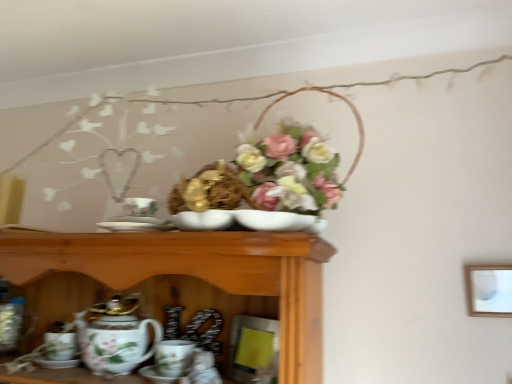
Question: Can you confirm if porcelain coffee cup at lower center is positioned to the left of matte white picture frame at upper right?

Choices:
 (A) yes
 (B) no

Answer: (A)

Question: Are porcelain coffee cup at lower center and matte white picture frame at upper right far apart?

Choices:
 (A) no
 (B) yes

Answer: (A)

Question: Does porcelain coffee cup at lower center have a lesser height compared to matte white picture frame at upper right?

Choices:
 (A) no
 (B) yes

Answer: (B)

Question: From the image's perspective, is porcelain coffee cup at lower center located beneath matte white picture frame at upper right?

Choices:
 (A) no
 (B) yes

Answer: (B)

Question: Is porcelain coffee cup at lower center positioned before matte white picture frame at upper right?

Choices:
 (A) yes
 (B) no

Answer: (A)

Question: From a real-world perspective, is porcelain coffee cup at lower center above or below matte white picture frame at upper right?

Choices:
 (A) above
 (B) below

Answer: (B)

Question: Is porcelain coffee cup at lower center wider or thinner than matte white picture frame at upper right?

Choices:
 (A) wide
 (B) thin

Answer: (A)

Question: Is porcelain coffee cup at lower center taller or shorter than matte white picture frame at upper right?

Choices:
 (A) short
 (B) tall

Answer: (A)

Question: Considering the positions of point (167, 344) and point (507, 278), is point (167, 344) closer or farther from the camera than point (507, 278)?

Choices:
 (A) farther
 (B) closer

Answer: (A)

Question: Do you think matte white picture frame at upper right is within porcelain floral teapot at lower left, or outside of it?

Choices:
 (A) inside
 (B) outside

Answer: (B)

Question: Does point (484, 284) appear closer or farther from the camera than point (101, 344)?

Choices:
 (A) farther
 (B) closer

Answer: (A)

Question: Is matte white picture frame at upper right bigger or smaller than porcelain floral teapot at lower left?

Choices:
 (A) big
 (B) small

Answer: (B)

Question: In the image, is matte white picture frame at upper right positioned in front of or behind porcelain floral teapot at lower left?

Choices:
 (A) behind
 (B) front

Answer: (A)

Question: Considering the positions of porcelain coffee cup at lower center and porcelain plate at center in the image, is porcelain coffee cup at lower center wider or thinner than porcelain plate at center?

Choices:
 (A) thin
 (B) wide

Answer: (B)

Question: From their relative heights in the image, would you say porcelain coffee cup at lower center is taller or shorter than porcelain plate at center?

Choices:
 (A) short
 (B) tall

Answer: (B)